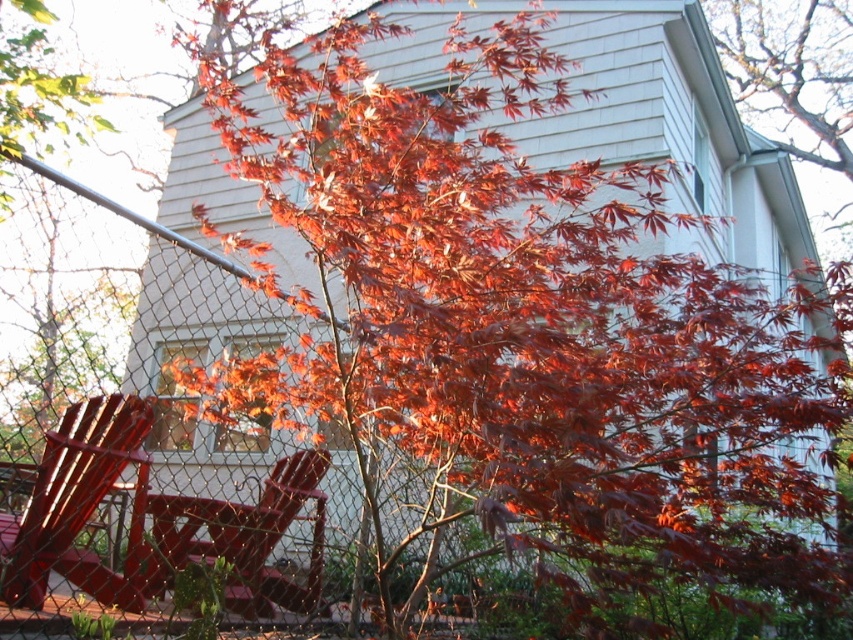
Question: Is the position of metallic red chair at lower left more distant than that of matte red chair at lower left?

Choices:
 (A) yes
 (B) no

Answer: (A)

Question: Does metallic red chair at lower left appear under matte red chair at lower left?

Choices:
 (A) yes
 (B) no

Answer: (B)

Question: Does metallic red chair at lower left have a lesser width compared to matte red chair at lower left?

Choices:
 (A) yes
 (B) no

Answer: (B)

Question: Which point is farther from the camera taking this photo?

Choices:
 (A) click(x=61, y=531)
 (B) click(x=165, y=577)

Answer: (B)